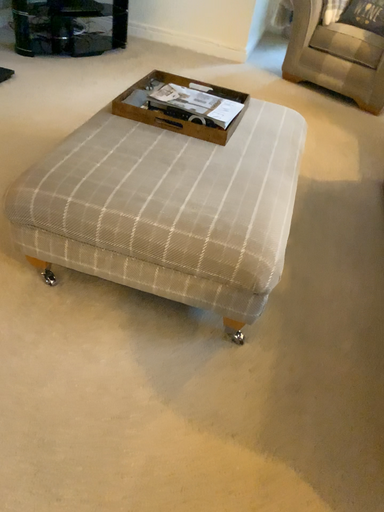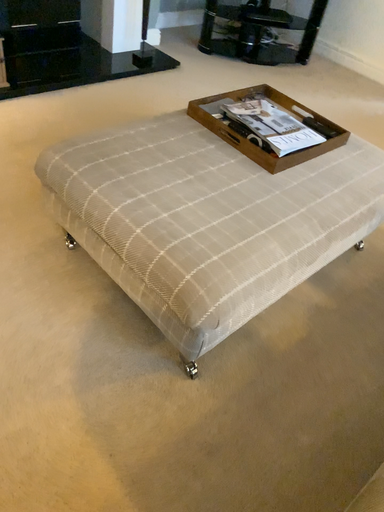
Question: Which way did the camera rotate in the video?

Choices:
 (A) rotated left
 (B) rotated right

Answer: (A)